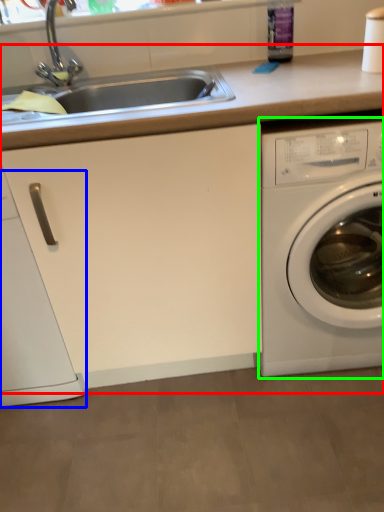
Question: Considering the real-world distances, which object is farthest from counter top (highlighted by a red box)? dish washer (highlighted by a blue box) or washing machine (highlighted by a green box)?

Choices:
 (A) dish washer
 (B) washing machine

Answer: (A)